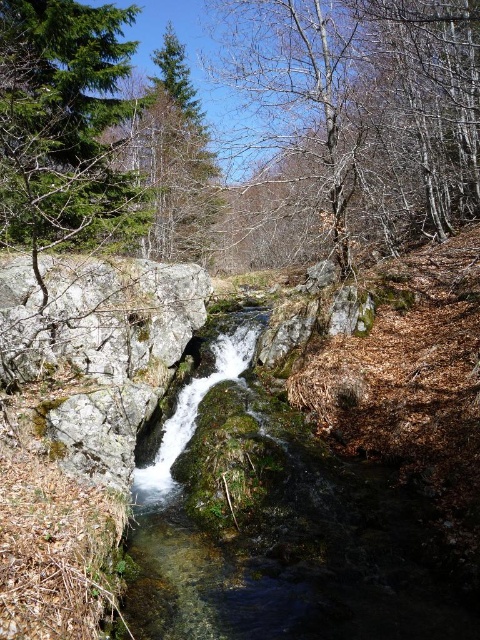
Question: From the image, what is the correct spatial relationship of clear water at center in relation to bare branches at upper center?

Choices:
 (A) left
 (B) right

Answer: (B)

Question: Can you confirm if clear water at center is wider than bare branches at upper center?

Choices:
 (A) no
 (B) yes

Answer: (B)

Question: Can you confirm if clear water at center is bigger than bare branches at upper center?

Choices:
 (A) yes
 (B) no

Answer: (A)

Question: Which object appears farthest from the camera in this image?

Choices:
 (A) bare branches at upper center
 (B) clear water at center

Answer: (A)